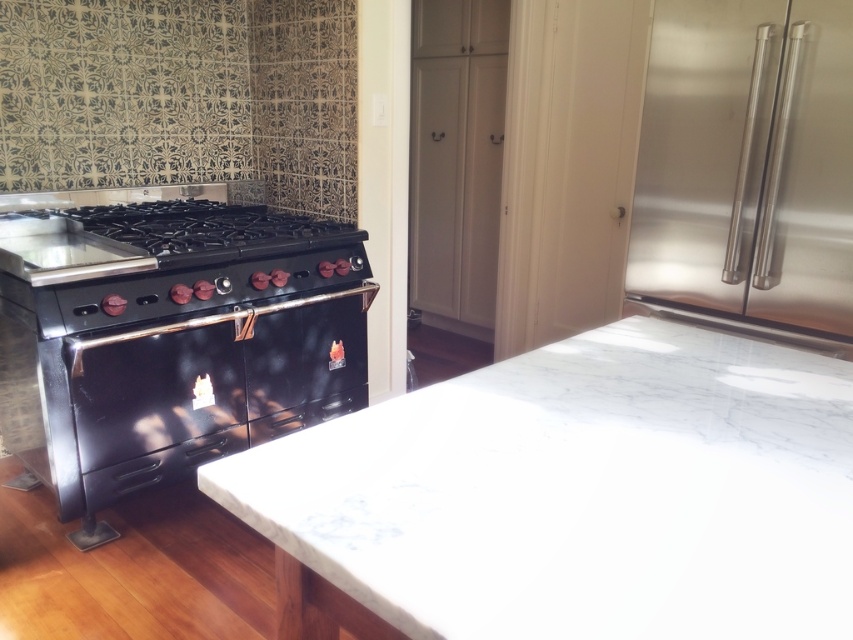
Question: Considering the real-world distances, which object is closest to the stainless steel refrigerator at right?

Choices:
 (A) black glossy oven at center
 (B) white marble countertop at center

Answer: (B)

Question: Can you confirm if white marble countertop at center is positioned to the right of black glossy oven at center?

Choices:
 (A) no
 (B) yes

Answer: (B)

Question: Is white marble countertop at center above stainless steel refrigerator at right?

Choices:
 (A) no
 (B) yes

Answer: (A)

Question: Which object is positioned closest to the stainless steel refrigerator at right?

Choices:
 (A) black glossy oven at center
 (B) white marble countertop at center

Answer: (B)

Question: Is stainless steel refrigerator at right smaller than black glossy oven at center?

Choices:
 (A) no
 (B) yes

Answer: (B)

Question: Which is farther from the black glossy oven at center?

Choices:
 (A) stainless steel refrigerator at right
 (B) white marble countertop at center

Answer: (A)